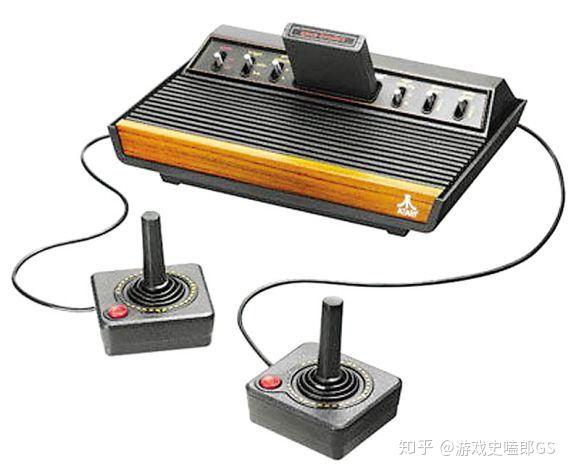
The height and width of the screenshot is (473, 570). Find the location of `wires`. wires is located at coordinates (128, 204), (472, 278).